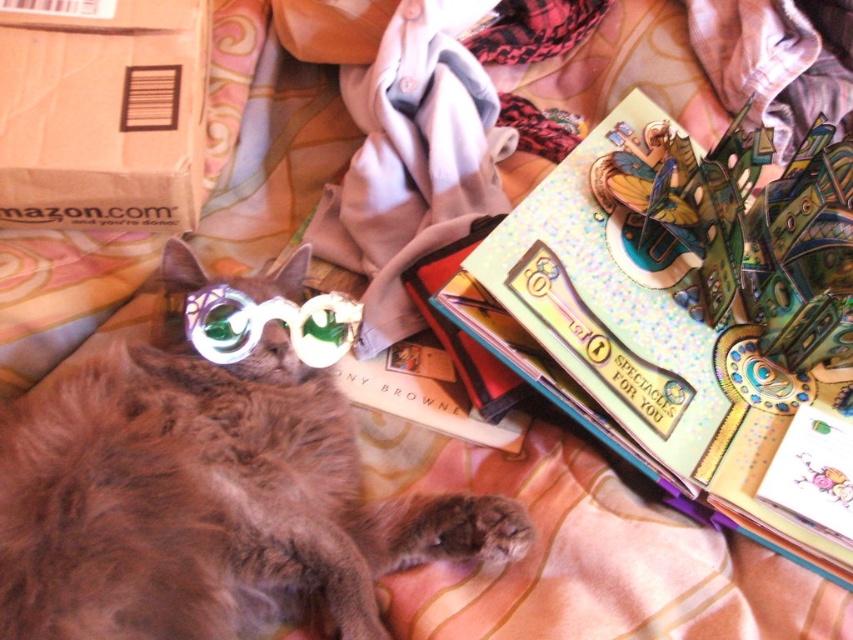
Can you confirm if fuzzy brown cat at center is bigger than translucent plastic goggles at center?

Yes.

This screenshot has width=853, height=640. I want to click on fuzzy brown cat at center, so click(x=206, y=500).

The width and height of the screenshot is (853, 640). In order to click on fuzzy brown cat at center in this screenshot , I will do `click(206, 500)`.

Is fuzzy brown cat at center thinner than metallic silver key at upper right?

In fact, fuzzy brown cat at center might be wider than metallic silver key at upper right.

Describe the element at coordinates (206, 500) in the screenshot. This screenshot has height=640, width=853. I see `fuzzy brown cat at center` at that location.

Which is behind, point (383, 547) or point (804, 13)?

Point (804, 13)

This screenshot has height=640, width=853. Identify the location of fuzzy brown cat at center. (206, 500).

Can you confirm if metallic silver key at upper right is positioned to the left of translucent plastic goggles at center?

Incorrect, metallic silver key at upper right is not on the left side of translucent plastic goggles at center.

Does point (804, 122) lie in front of point (248, 305)?

No, (804, 122) is behind (248, 305).

The image size is (853, 640). What are the coordinates of `metallic silver key at upper right` in the screenshot? It's located at (776, 60).